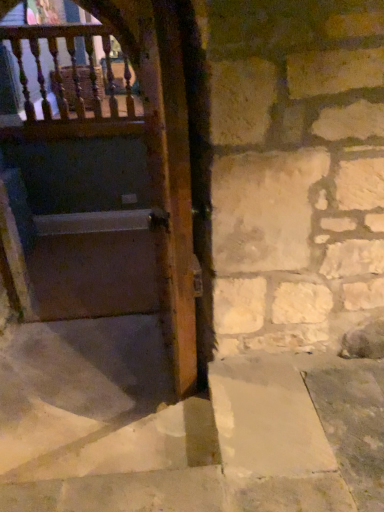
Question: Is wooden balusters at upper left oriented away from matte wooden door at left?

Choices:
 (A) yes
 (B) no

Answer: (B)

Question: From a real-world perspective, is wooden balusters at upper left under matte wooden door at left?

Choices:
 (A) yes
 (B) no

Answer: (B)

Question: Could you tell me if wooden balusters at upper left is turned towards matte wooden door at left?

Choices:
 (A) yes
 (B) no

Answer: (A)

Question: Does wooden balusters at upper left appear on the right side of matte wooden door at left?

Choices:
 (A) yes
 (B) no

Answer: (B)

Question: Is wooden balusters at upper left thinner than matte wooden door at left?

Choices:
 (A) no
 (B) yes

Answer: (B)

Question: Is wooden balusters at upper left touching matte wooden door at left?

Choices:
 (A) yes
 (B) no

Answer: (B)

Question: From the image's perspective, is matte wooden door at left below smooth concrete stairs at center?

Choices:
 (A) no
 (B) yes

Answer: (A)

Question: Can you confirm if matte wooden door at left is positioned to the left of smooth concrete stairs at center?

Choices:
 (A) yes
 (B) no

Answer: (A)

Question: From a real-world perspective, is matte wooden door at left below smooth concrete stairs at center?

Choices:
 (A) yes
 (B) no

Answer: (B)

Question: Is matte wooden door at left closer to camera compared to smooth concrete stairs at center?

Choices:
 (A) yes
 (B) no

Answer: (B)

Question: Would you consider matte wooden door at left to be distant from smooth concrete stairs at center?

Choices:
 (A) no
 (B) yes

Answer: (B)

Question: Is matte wooden door at left beside smooth concrete stairs at center?

Choices:
 (A) yes
 (B) no

Answer: (B)

Question: Is smooth concrete stairs at center not near wooden balusters at upper left?

Choices:
 (A) no
 (B) yes

Answer: (B)